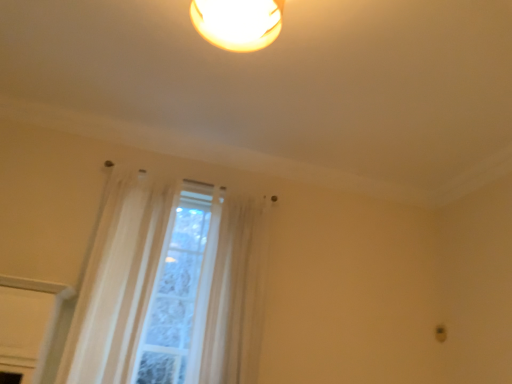
Question: Which direction should I rotate to face white sheer curtain at center, positioned as the 2th curtain in right-to-left order, — up or down?

Choices:
 (A) up
 (B) down

Answer: (B)

Question: Does white sheer curtain at center, the first curtain when ordered from left to right, have a lesser height compared to sheer white curtain at center, the 1th curtain positioned from the right?

Choices:
 (A) yes
 (B) no

Answer: (B)

Question: Is white sheer curtain at center, positioned as the 2th curtain in right-to-left order, further to camera compared to sheer white curtain at center, the 1th curtain positioned from the right?

Choices:
 (A) yes
 (B) no

Answer: (B)

Question: Considering the relative sizes of white sheer curtain at center, the first curtain when ordered from left to right, and sheer white curtain at center, which appears as the second curtain when viewed from the left, in the image provided, is white sheer curtain at center, the first curtain when ordered from left to right, smaller than sheer white curtain at center, which appears as the second curtain when viewed from the left,?

Choices:
 (A) yes
 (B) no

Answer: (A)

Question: Does white sheer curtain at center, positioned as the 2th curtain in right-to-left order, appear on the left side of sheer white curtain at center, which appears as the second curtain when viewed from the left?

Choices:
 (A) no
 (B) yes

Answer: (B)

Question: From the image's perspective, is white sheer curtain at center, the first curtain when ordered from left to right, below sheer white curtain at center, the 1th curtain positioned from the right?

Choices:
 (A) yes
 (B) no

Answer: (B)

Question: Is white sheer curtain at center, positioned as the 2th curtain in right-to-left order, taller than sheer white curtain at center, the 1th curtain positioned from the right?

Choices:
 (A) no
 (B) yes

Answer: (B)

Question: Could you tell me if sheer white curtain at center, which appears as the second curtain when viewed from the left, is facing white sheer curtain at center, positioned as the 2th curtain in right-to-left order?

Choices:
 (A) yes
 (B) no

Answer: (B)

Question: From the image's perspective, would you say sheer white curtain at center, the 1th curtain positioned from the right, is positioned over white sheer curtain at center, positioned as the 2th curtain in right-to-left order?

Choices:
 (A) no
 (B) yes

Answer: (A)

Question: From a real-world perspective, is sheer white curtain at center, which appears as the second curtain when viewed from the left, on top of white sheer curtain at center, positioned as the 2th curtain in right-to-left order?

Choices:
 (A) no
 (B) yes

Answer: (B)

Question: Is sheer white curtain at center, which appears as the second curtain when viewed from the left, facing away from white sheer curtain at center, positioned as the 2th curtain in right-to-left order?

Choices:
 (A) no
 (B) yes

Answer: (A)

Question: Considering the relative positions of sheer white curtain at center, the 1th curtain positioned from the right, and white sheer curtain at center, positioned as the 2th curtain in right-to-left order, in the image provided, is sheer white curtain at center, the 1th curtain positioned from the right, to the right of white sheer curtain at center, positioned as the 2th curtain in right-to-left order, from the viewer's perspective?

Choices:
 (A) yes
 (B) no

Answer: (A)

Question: Is sheer white curtain at center, which appears as the second curtain when viewed from the left, further to camera compared to white sheer curtain at center, the first curtain when ordered from left to right?

Choices:
 (A) yes
 (B) no

Answer: (A)

Question: From their relative heights in the image, would you say white sheer curtain at center, the first curtain when ordered from left to right, is taller or shorter than sheer white curtain at center, which appears as the second curtain when viewed from the left?

Choices:
 (A) short
 (B) tall

Answer: (B)